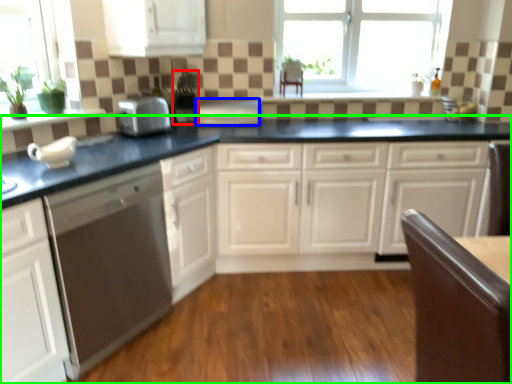
Question: Estimate the real-world distances between objects in this image. Which object is farther from appliance (highlighted by a red box), appliance (highlighted by a blue box) or countertop (highlighted by a green box)?

Choices:
 (A) appliance
 (B) countertop

Answer: (B)